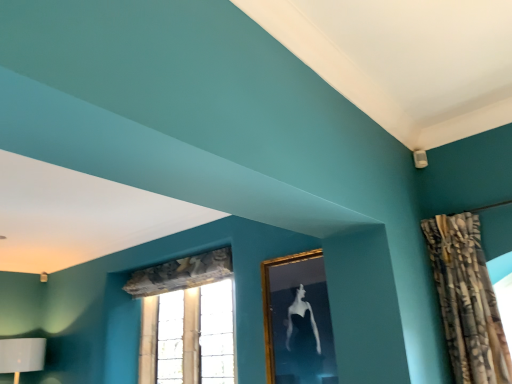
Question: Does clear glass window at center appear on the left side of textured beige curtain at upper right?

Choices:
 (A) yes
 (B) no

Answer: (A)

Question: Can we say clear glass window at center lies outside textured beige curtain at upper right?

Choices:
 (A) yes
 (B) no

Answer: (A)

Question: Is textured beige curtain at upper right surrounded by clear glass window at center?

Choices:
 (A) no
 (B) yes

Answer: (A)

Question: Is clear glass window at center not close to textured beige curtain at upper right?

Choices:
 (A) yes
 (B) no

Answer: (A)

Question: From the image's perspective, would you say clear glass window at center is positioned over textured beige curtain at upper right?

Choices:
 (A) yes
 (B) no

Answer: (B)

Question: Would you say clear glass window at center is inside or outside gold-framed picture at upper center?

Choices:
 (A) inside
 (B) outside

Answer: (B)

Question: From the image's perspective, is clear glass window at center above or below gold-framed picture at upper center?

Choices:
 (A) above
 (B) below

Answer: (B)

Question: Is clear glass window at center to the left or to the right of gold-framed picture at upper center in the image?

Choices:
 (A) left
 (B) right

Answer: (A)

Question: Considering their positions, is clear glass window at center located in front of or behind gold-framed picture at upper center?

Choices:
 (A) behind
 (B) front

Answer: (A)

Question: Do you think textured beige curtain at upper right is within gold-framed picture at upper center, or outside of it?

Choices:
 (A) inside
 (B) outside

Answer: (B)

Question: From the image's perspective, is textured beige curtain at upper right located above or below gold-framed picture at upper center?

Choices:
 (A) above
 (B) below

Answer: (A)

Question: From a real-world perspective, is textured beige curtain at upper right physically located above or below gold-framed picture at upper center?

Choices:
 (A) below
 (B) above

Answer: (B)

Question: Is textured beige curtain at upper right in front of or behind gold-framed picture at upper center in the image?

Choices:
 (A) front
 (B) behind

Answer: (A)

Question: Is clear glass window at center in front of or behind textured beige curtain at upper right in the image?

Choices:
 (A) behind
 (B) front

Answer: (A)

Question: From a real-world perspective, is clear glass window at center positioned above or below textured beige curtain at upper right?

Choices:
 (A) below
 (B) above

Answer: (A)